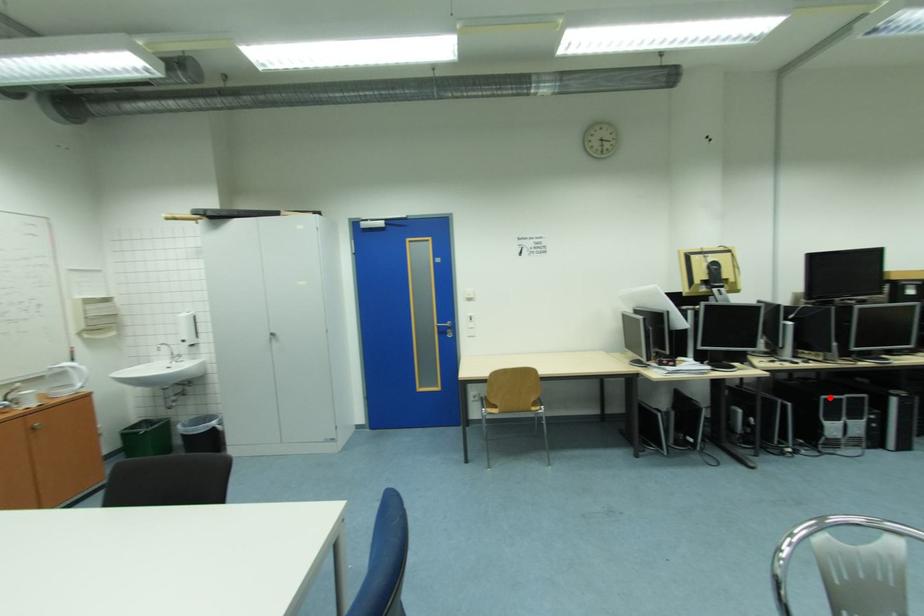
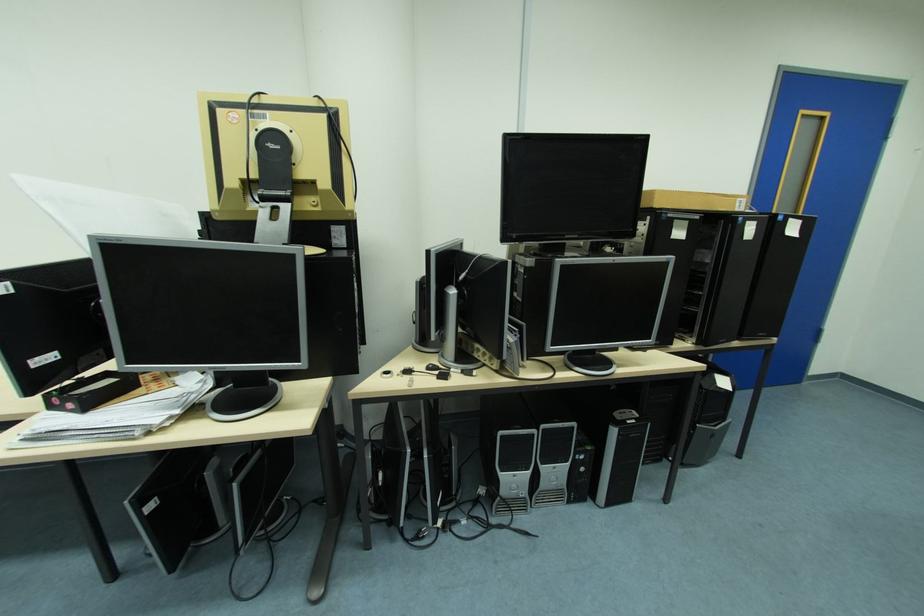
Question: I am providing you with two images of the same scene from different viewpoints. A red point is marked on the first image. Can you still see the location of the red point in image 2?

Choices:
 (A) Yes
 (B) No

Answer: (A)